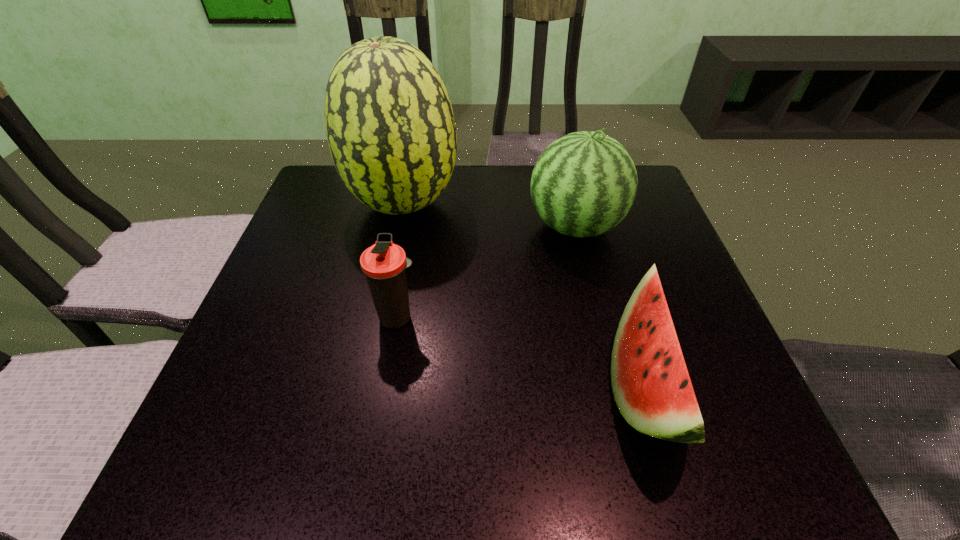
Identify the location of the tallest object. (390, 127).

The image size is (960, 540). Find the location of `the tallest watermelon`. the tallest watermelon is located at coordinates (390, 127).

Locate an element on the screen. The image size is (960, 540). the second tallest object is located at coordinates (583, 184).

At what (x,y) coordinates should I click in order to perform the action: click on thermos bottle. Please return your answer as a coordinate pair (x, y). Looking at the image, I should click on (384, 263).

You are a GUI agent. You are given a task and a screenshot of the screen. Output one action in this format:
    pyautogui.click(x=<x>, y=<y>)
    Task: Click on the nearest watermelon
    
    Given the screenshot: What is the action you would take?
    pyautogui.click(x=651, y=385)

Where is `blank space located 0.090m on the front of the leftmost watermelon`? The width and height of the screenshot is (960, 540). blank space located 0.090m on the front of the leftmost watermelon is located at coordinates (391, 266).

I want to click on free space located 0.050m on the front of the second tallest object, so click(x=587, y=275).

Find the location of `free spot located 0.220m on the front of the thermos bottle`. free spot located 0.220m on the front of the thermos bottle is located at coordinates (374, 451).

The height and width of the screenshot is (540, 960). Find the location of `vacant space located on the outer rind of the nearest watermelon`. vacant space located on the outer rind of the nearest watermelon is located at coordinates (428, 386).

Identify the location of vacant area situated on the outer rind of the nearest watermelon. (393, 386).